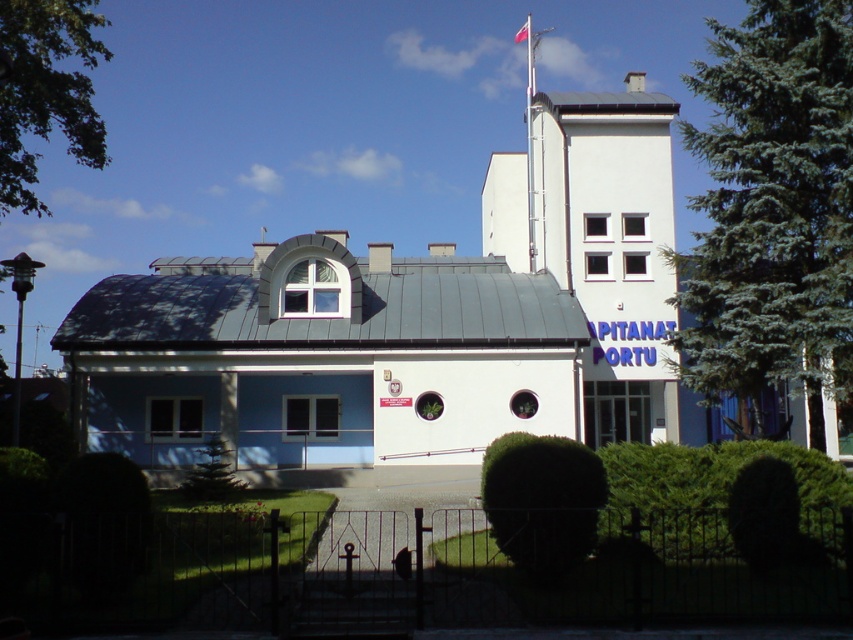
The height and width of the screenshot is (640, 853). I want to click on blue matte building at center, so click(x=410, y=321).

Between blue matte building at center and red fabric flag at upper center, which one has more height?

blue matte building at center is taller.

What do you see at coordinates (410, 321) in the screenshot? The image size is (853, 640). I see `blue matte building at center` at bounding box center [410, 321].

What are the coordinates of `blue matte building at center` in the screenshot? It's located at (410, 321).

Identify the location of green leafy hedge at center. (712, 476).

Image resolution: width=853 pixels, height=640 pixels. What are the coordinates of `green leafy hedge at center` in the screenshot? It's located at (712, 476).

Where is `green leafy hedge at center`? green leafy hedge at center is located at coordinates (712, 476).

Does green leafy tree at upper left appear on the right side of green bushy hedge at center?

No, green leafy tree at upper left is not to the right of green bushy hedge at center.

Does green leafy tree at upper left appear over green bushy hedge at center?

Yes.

Who is more forward, (80,102) or (511,440)?

Point (511,440) is in front.

This screenshot has width=853, height=640. Find the location of `green leafy tree at upper left`. green leafy tree at upper left is located at coordinates (45, 90).